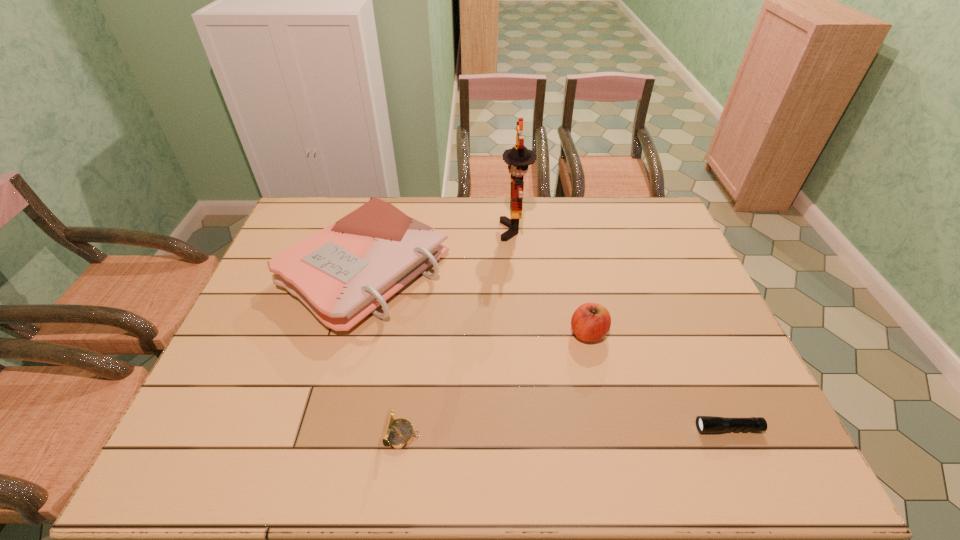
Identify the location of vacant area between the fourth object from left to right and the rightmost object. (659, 381).

Where is `free space between the phonebook and the second object from right to left`? This screenshot has height=540, width=960. free space between the phonebook and the second object from right to left is located at coordinates (477, 301).

Where is `free spot between the tallest object and the rightmost object`? This screenshot has height=540, width=960. free spot between the tallest object and the rightmost object is located at coordinates (621, 329).

You are a GUI agent. You are given a task and a screenshot of the screen. Output one action in this format:
    pyautogui.click(x=<x>, y=<y>)
    Task: Click on the empty space between the nutcracker and the fourth tallest object
    
    Given the screenshot: What is the action you would take?
    pyautogui.click(x=458, y=333)

Locate an element on the screen. This screenshot has width=960, height=540. free space between the second shortest object and the fourth object from left to right is located at coordinates (494, 384).

This screenshot has width=960, height=540. Find the location of `free point between the apple and the phonebook`. free point between the apple and the phonebook is located at coordinates (477, 301).

This screenshot has height=540, width=960. In order to click on free space between the third object from left to right and the second object from right to left in this screenshot , I will do `click(551, 282)`.

I want to click on object identified as the third closest to the compass, so click(x=519, y=157).

I want to click on object that is the second closest to the nutcracker, so click(590, 322).

Where is `vacant point that satisfies the following two spatial constraints: 1. on the back side of the apple; 2. on the front-facing side of the nutcracker`? This screenshot has height=540, width=960. vacant point that satisfies the following two spatial constraints: 1. on the back side of the apple; 2. on the front-facing side of the nutcracker is located at coordinates (565, 231).